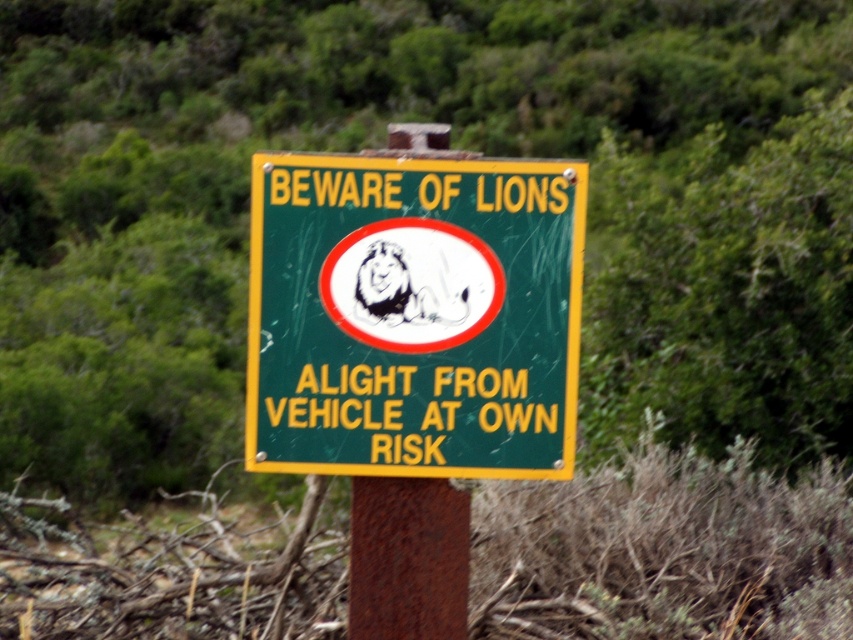
Question: Where is green matte sign at center located in relation to rusty metal pole at center in the image?

Choices:
 (A) below
 (B) above

Answer: (B)

Question: Which of these objects is positioned closest to the rusty metal post at center?

Choices:
 (A) rusty metal pole at center
 (B) green matte sign at center

Answer: (A)

Question: Which object appears farthest from the camera in this image?

Choices:
 (A) rusty metal pole at center
 (B) green matte sign at center
 (C) rusty metal post at center

Answer: (A)

Question: Can you confirm if green matte sign at center is positioned to the right of rusty metal pole at center?

Choices:
 (A) yes
 (B) no

Answer: (A)

Question: Which is farther from the green matte sign at center?

Choices:
 (A) rusty metal post at center
 (B) rusty metal pole at center

Answer: (B)

Question: Does green matte sign at center appear on the left side of rusty metal post at center?

Choices:
 (A) no
 (B) yes

Answer: (A)